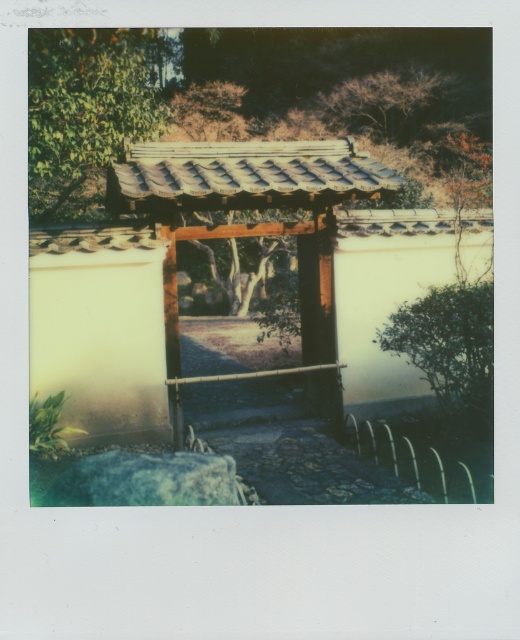
In the scene shown: Can you confirm if wooden gate at center is bigger than green leafy tree at upper left?

Incorrect, wooden gate at center is not larger than green leafy tree at upper left.

Does wooden gate at center have a greater height compared to green leafy tree at upper left?

In fact, wooden gate at center may be shorter than green leafy tree at upper left.

Between point (299, 200) and point (154, 93), which one is positioned behind?

The point (154, 93) is behind.

You are a GUI agent. You are given a task and a screenshot of the screen. Output one action in this format:
    pyautogui.click(x=<x>, y=<y>)
    Task: Click on the wooden gate at center
    Image resolution: width=520 pixels, height=640 pixels.
    Given the screenshot: What is the action you would take?
    pyautogui.click(x=254, y=221)

Which of these two, green leafy tree at upper left or green leafy tree at right, stands taller?

With more height is green leafy tree at upper left.

Image resolution: width=520 pixels, height=640 pixels. What do you see at coordinates (88, 109) in the screenshot? I see `green leafy tree at upper left` at bounding box center [88, 109].

The height and width of the screenshot is (640, 520). I want to click on green leafy tree at upper left, so click(88, 109).

Can you confirm if green leafy tree at upper left is positioned to the right of brown textured tree at upper center?

Incorrect, green leafy tree at upper left is not on the right side of brown textured tree at upper center.

Does green leafy tree at upper left have a larger size compared to brown textured tree at upper center?

Indeed, green leafy tree at upper left has a larger size compared to brown textured tree at upper center.

Does point (162, 33) lie behind point (434, 112)?

Yes.

The width and height of the screenshot is (520, 640). What are the coordinates of `green leafy tree at upper left` in the screenshot? It's located at (88, 109).